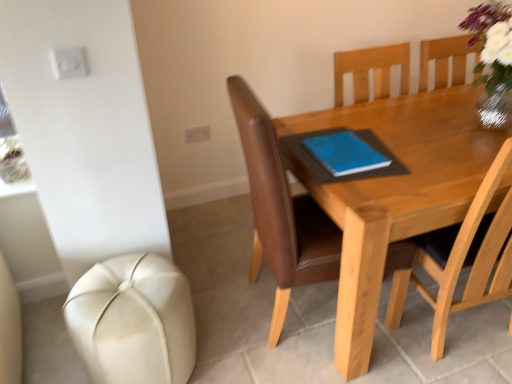
Question: Could you tell me if brown leather chair at center is facing wooden table at center?

Choices:
 (A) yes
 (B) no

Answer: (A)

Question: Is brown leather chair at center outside wooden table at center?

Choices:
 (A) yes
 (B) no

Answer: (B)

Question: Does brown leather chair at center lie in front of wooden table at center?

Choices:
 (A) yes
 (B) no

Answer: (A)

Question: From the image's perspective, does brown leather chair at center appear higher than wooden table at center?

Choices:
 (A) no
 (B) yes

Answer: (A)

Question: Is brown leather chair at center shorter than wooden table at center?

Choices:
 (A) yes
 (B) no

Answer: (B)

Question: Is brown leather chair at center wider than wooden table at center?

Choices:
 (A) no
 (B) yes

Answer: (A)

Question: Is blue matte notebook at center outside wooden table at center?

Choices:
 (A) no
 (B) yes

Answer: (B)

Question: Does blue matte notebook at center have a lesser height compared to wooden table at center?

Choices:
 (A) no
 (B) yes

Answer: (B)

Question: Considering the relative sizes of blue matte notebook at center and wooden table at center in the image provided, is blue matte notebook at center taller than wooden table at center?

Choices:
 (A) yes
 (B) no

Answer: (B)

Question: Is blue matte notebook at center smaller than wooden table at center?

Choices:
 (A) no
 (B) yes

Answer: (B)

Question: Is blue matte notebook at center thinner than wooden table at center?

Choices:
 (A) yes
 (B) no

Answer: (A)

Question: From a real-world perspective, is blue matte notebook at center located higher than wooden table at center?

Choices:
 (A) yes
 (B) no

Answer: (A)

Question: From a real-world perspective, is white leather ottoman at lower left under wooden table at center?

Choices:
 (A) no
 (B) yes

Answer: (B)